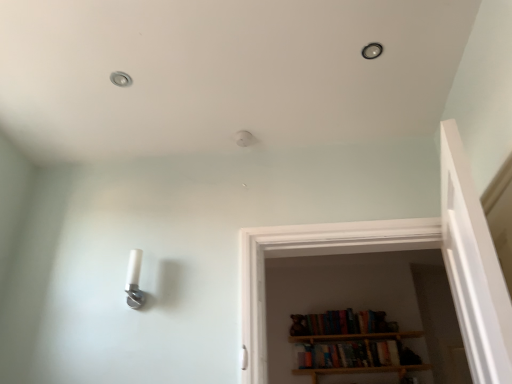
Question: Can you confirm if metallic ceiling light at upper left is thinner than wooden bookshelf at center?

Choices:
 (A) no
 (B) yes

Answer: (B)

Question: From the image's perspective, is metallic ceiling light at upper left below wooden bookshelf at center?

Choices:
 (A) yes
 (B) no

Answer: (B)

Question: Can you confirm if metallic ceiling light at upper left is wider than wooden bookshelf at center?

Choices:
 (A) no
 (B) yes

Answer: (A)

Question: Is metallic ceiling light at upper left bigger than wooden bookshelf at center?

Choices:
 (A) yes
 (B) no

Answer: (B)

Question: Is metallic ceiling light at upper left next to wooden bookshelf at center and touching it?

Choices:
 (A) yes
 (B) no

Answer: (B)

Question: From a real-world perspective, is wooden bookshelf at center positioned above or below matte black light fixture at upper center?

Choices:
 (A) below
 (B) above

Answer: (A)

Question: Would you say wooden bookshelf at center is inside or outside matte black light fixture at upper center?

Choices:
 (A) inside
 (B) outside

Answer: (B)

Question: Is wooden bookshelf at center taller or shorter than matte black light fixture at upper center?

Choices:
 (A) tall
 (B) short

Answer: (A)

Question: From the image's perspective, relative to matte black light fixture at upper center, is wooden bookshelf at center above or below?

Choices:
 (A) above
 (B) below

Answer: (B)

Question: Is metallic ceiling light at upper left taller or shorter than wooden bookshelf at center?

Choices:
 (A) short
 (B) tall

Answer: (A)

Question: Relative to wooden bookshelf at center, is metallic ceiling light at upper left in front or behind?

Choices:
 (A) front
 (B) behind

Answer: (A)

Question: In the image, is metallic ceiling light at upper left on the left side or the right side of wooden bookshelf at center?

Choices:
 (A) right
 (B) left

Answer: (B)

Question: From the image's perspective, is metallic ceiling light at upper left positioned above or below wooden bookshelf at center?

Choices:
 (A) below
 (B) above

Answer: (B)

Question: From a real-world perspective, is white plastic light fixture at lower left physically located above or below metallic ceiling light at upper left?

Choices:
 (A) below
 (B) above

Answer: (A)

Question: Considering their positions, is white plastic light fixture at lower left located in front of or behind metallic ceiling light at upper left?

Choices:
 (A) front
 (B) behind

Answer: (B)